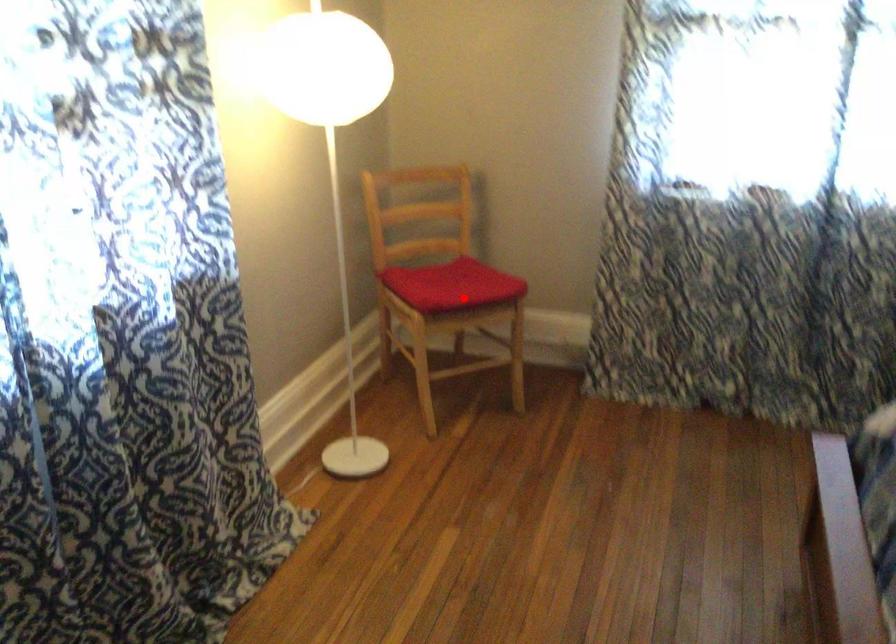
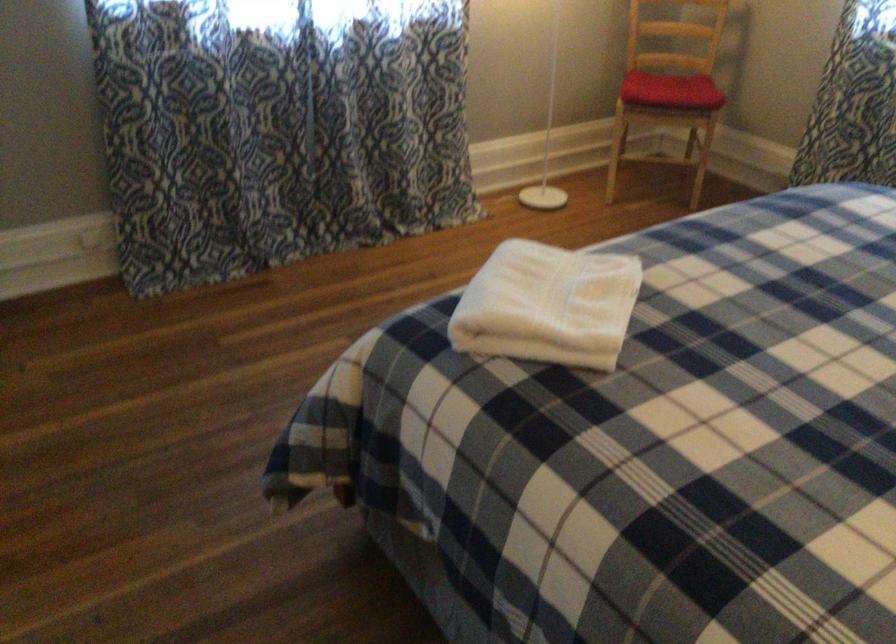
The point at the highlighted location is marked in the first image. Where is the corresponding point in the second image?

(670, 90)